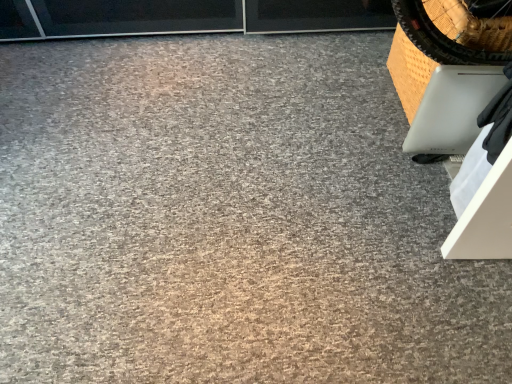
This screenshot has width=512, height=384. Describe the element at coordinates (452, 110) in the screenshot. I see `satin white laptop at right` at that location.

You are a GUI agent. You are given a task and a screenshot of the screen. Output one action in this format:
    pyautogui.click(x=<x>, y=<y>)
    Task: Click on the satin white laptop at right
    The width and height of the screenshot is (512, 384).
    Given the screenshot: What is the action you would take?
    pyautogui.click(x=452, y=110)

Locate an element on the screen. The height and width of the screenshot is (384, 512). satin white laptop at right is located at coordinates (452, 110).